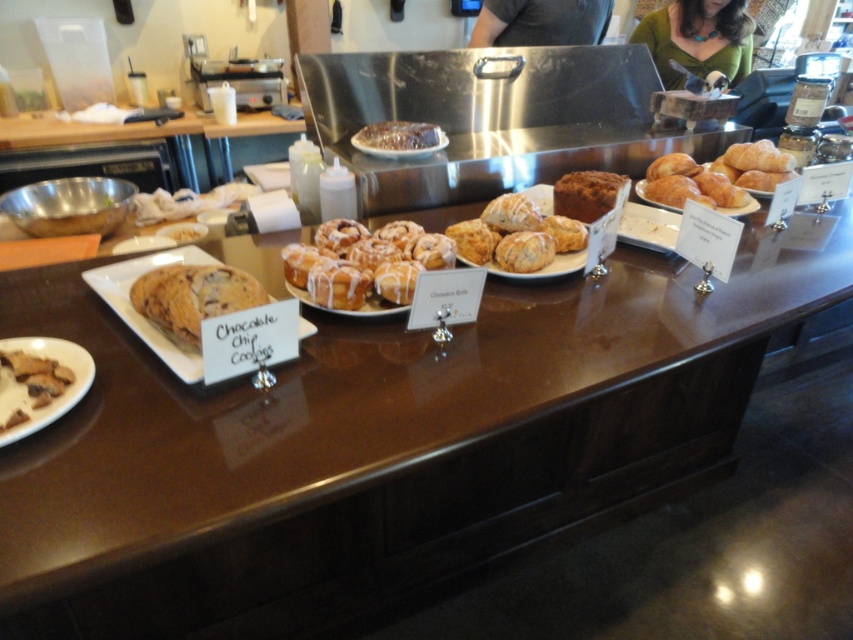
You are a customer at the bakery counter. You want to grab both the glazed pastry at center and the brown crumbly cookie at lower left. If you can only reach 30 inches, can you reach both items without moving your position?

The distance between the glazed pastry at center and the brown crumbly cookie at lower left is 31.23 inches. Since your reach is only 30 inches, you cannot reach both items without moving your position.

You are a customer at the bakery and want to choose a pastry that is bigger in size between the glazed pastry at center and the brown crumbly cookie at lower left. Which one should you pick?

The glazed pastry at center is larger in size than the brown crumbly cookie at lower left, so you should pick the glazed pastry at center.

In the scene shown: You are a customer at the bakery counter and see the green fabric shirt at upper center and the brown crumbly cookie at lower left. Which item is positioned higher on the counter?

The green fabric shirt at upper center is positioned higher than the brown crumbly cookie at lower left.